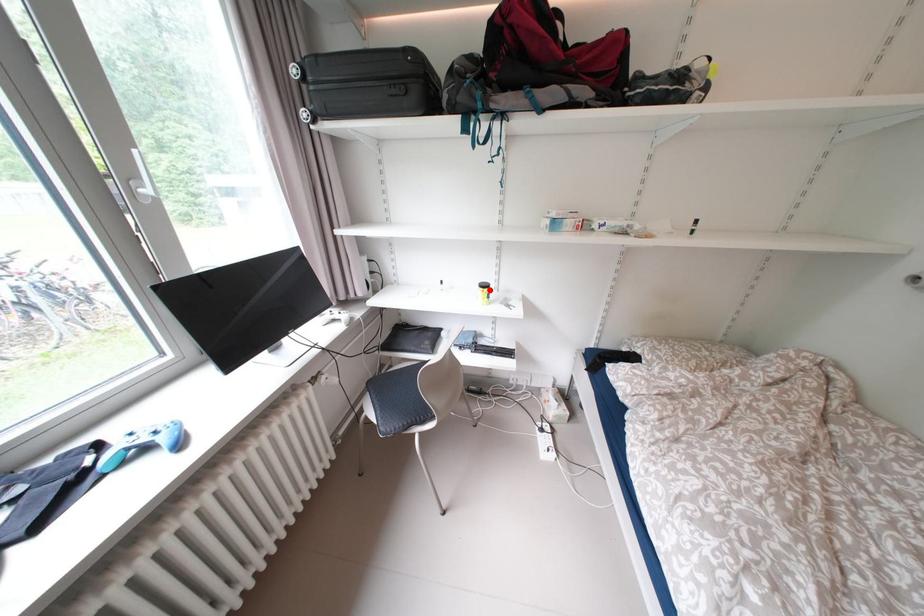
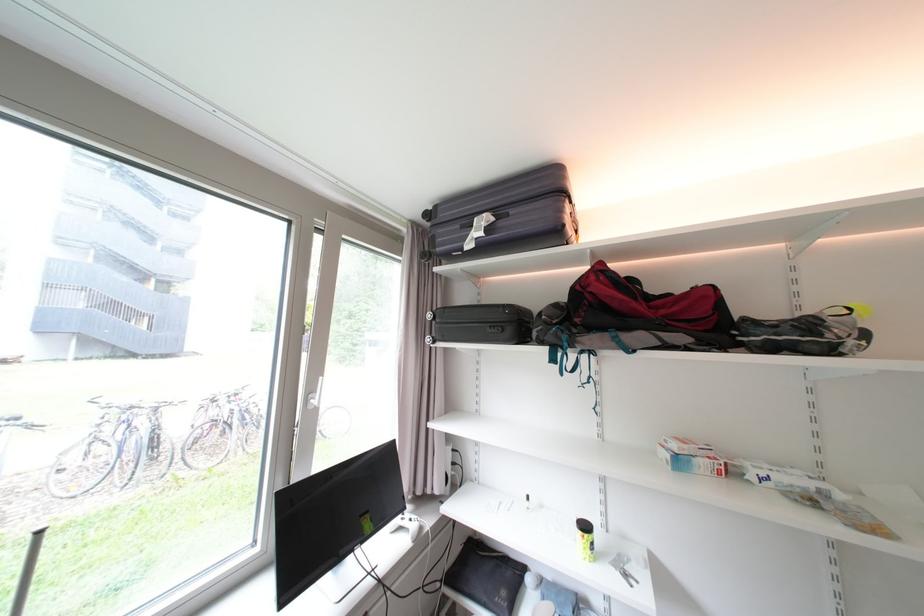
Where in the second image is the point corresponding to the highlighted location from the first image?

(589, 533)